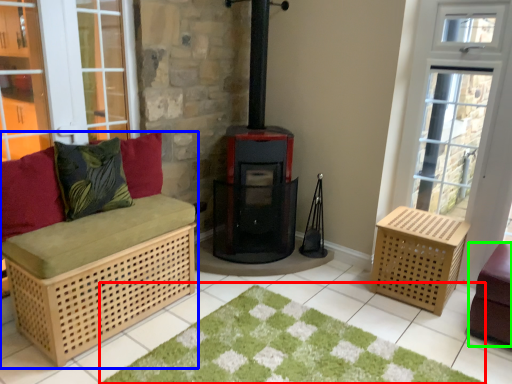
Question: Based on their relative distances, which object is farther from doormat (highlighted by a red box)? Choose from furniture (highlighted by a blue box) and furniture (highlighted by a green box).

Choices:
 (A) furniture
 (B) furniture

Answer: (B)